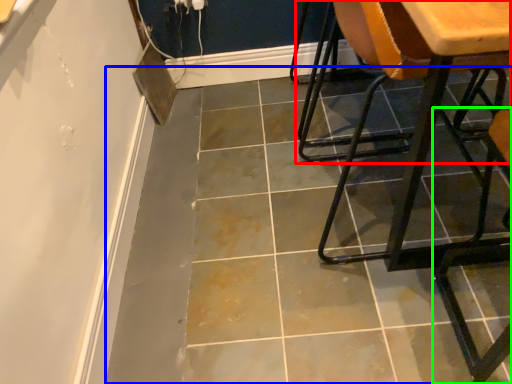
Question: Based on their relative distances, which object is farther from chair (highlighted by a red box)? Choose from concrete (highlighted by a blue box) and chair (highlighted by a green box).

Choices:
 (A) concrete
 (B) chair

Answer: (B)